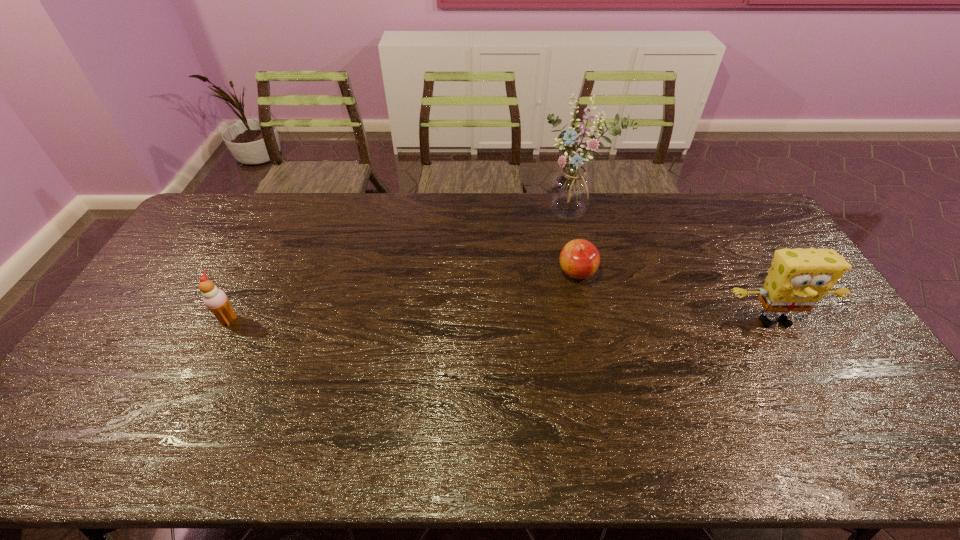
Locate an element on the screen. The width and height of the screenshot is (960, 540). vacant area between the tallest object and the icecream is located at coordinates (401, 266).

The height and width of the screenshot is (540, 960). In order to click on empty space between the shortest object and the third tallest object in this screenshot , I will do `click(402, 296)`.

Identify the location of free space that is in between the tallest object and the rightmost object. Image resolution: width=960 pixels, height=540 pixels. (674, 267).

Locate which object ranks second in proximity to the third shortest object. Please provide its 2D coordinates. Your answer should be formatted as a tuple, i.e. [(x, y)], where the tuple contains the x and y coordinates of a point satisfying the conditions above.

[(570, 190)]

Select which object appears as the closest to the second farthest object. Please provide its 2D coordinates. Your answer should be formatted as a tuple, i.e. [(x, y)], where the tuple contains the x and y coordinates of a point satisfying the conditions above.

[(570, 190)]